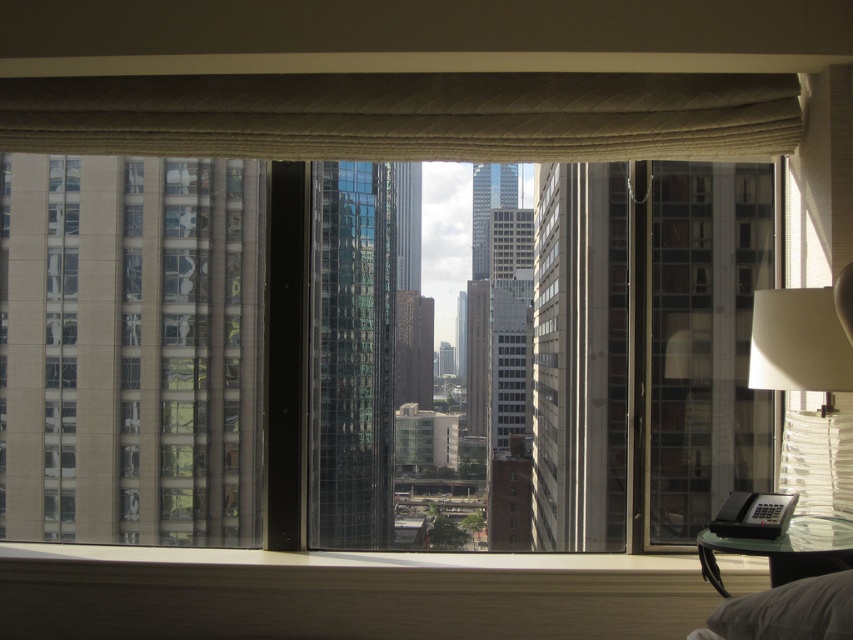
You are standing inside the room and want to look outside through the transparent glass window at center. However, the beige textured curtain at upper center is blocking your view. Can you move the curtain to the side to see the cityscape outside?

→ The transparent glass window at center is located below the beige textured curtain at upper center, so you can move the beige textured curtain at upper center to the side to reveal the window and see the cityscape outside.

Looking at this image, you are standing in the room and want to adjust the beige textured curtain at upper center to let in more light. Based on its current position at point coordinates, which direction should you move it to achieve this?

The beige textured curtain at upper center is currently at point coordinates. To let in more light, you should move it horizontally to the left or right to uncover the window area. However, without specific coordinate directions, the exact direction depends on the curtain mechanism.

You are an interior designer planning to install a new decorative hanging plant. You have two options to place it either on the transparent glass window at center or the beige textured curtain at upper center. Based on their heights, which location would allow the plant to hang lower without touching the floor?

The transparent glass window at center is taller than the beige textured curtain at upper center, so placing the decorative hanging plant on the transparent glass window at center would allow it to hang lower without touching the floor.